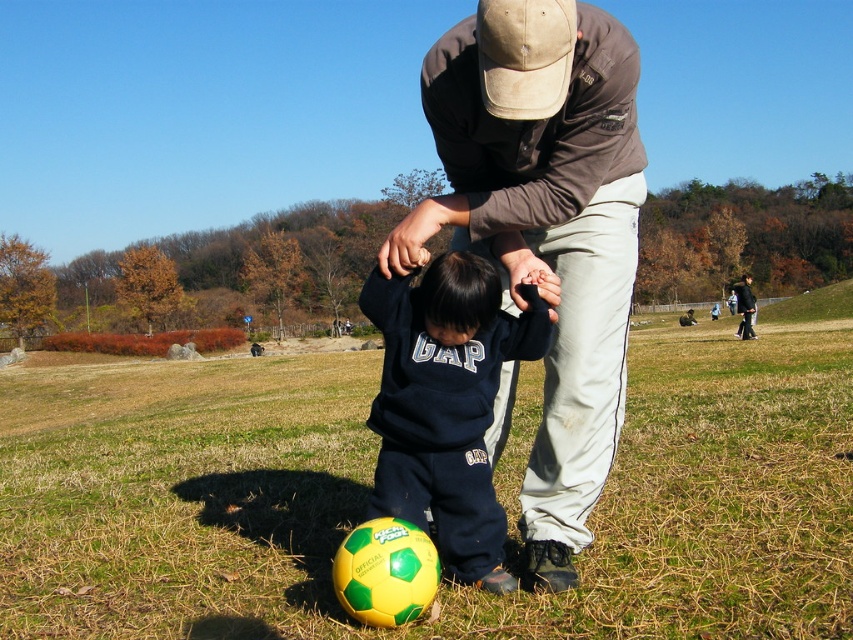
You are a parent looking for your child in the park. You see a brown cotton shirt at center and a dark blue sweater at lower center. Which clothing item is more likely to belong to your child?

The brown cotton shirt at center is smaller than the dark blue sweater at lower center, so the brown cotton shirt at center is more likely to belong to your child.